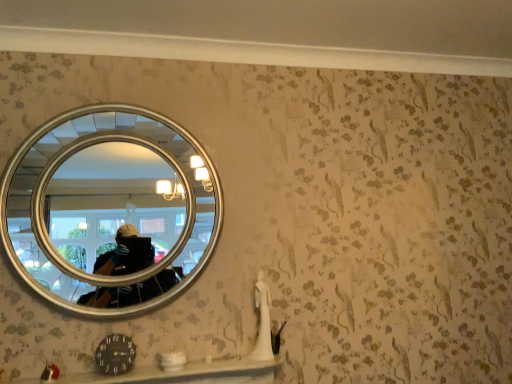
Question: Is silver/metallic mirror at upper left situated inside smooth white ledge at lower center or outside?

Choices:
 (A) inside
 (B) outside

Answer: (B)

Question: Is point (119, 292) closer or farther from the camera than point (263, 382)?

Choices:
 (A) farther
 (B) closer

Answer: (B)

Question: From a real-world perspective, is silver/metallic mirror at upper left physically located above or below smooth white ledge at lower center?

Choices:
 (A) above
 (B) below

Answer: (A)

Question: Would you say smooth white ledge at lower center is inside or outside silver/metallic mirror at upper left?

Choices:
 (A) outside
 (B) inside

Answer: (A)

Question: Is smooth white ledge at lower center taller or shorter than silver/metallic mirror at upper left?

Choices:
 (A) tall
 (B) short

Answer: (B)

Question: Does point (246, 382) appear closer or farther from the camera than point (51, 288)?

Choices:
 (A) closer
 (B) farther

Answer: (B)

Question: Relative to silver/metallic mirror at upper left, is smooth white ledge at lower center in front or behind?

Choices:
 (A) behind
 (B) front

Answer: (B)